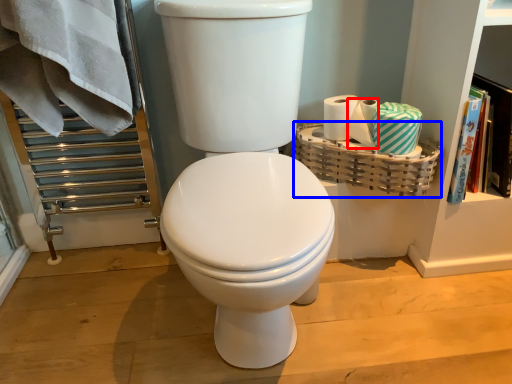
Question: Which of the following is the farthest to the observer, toilet paper (highlighted by a red box) or basket (highlighted by a blue box)?

Choices:
 (A) toilet paper
 (B) basket

Answer: (A)